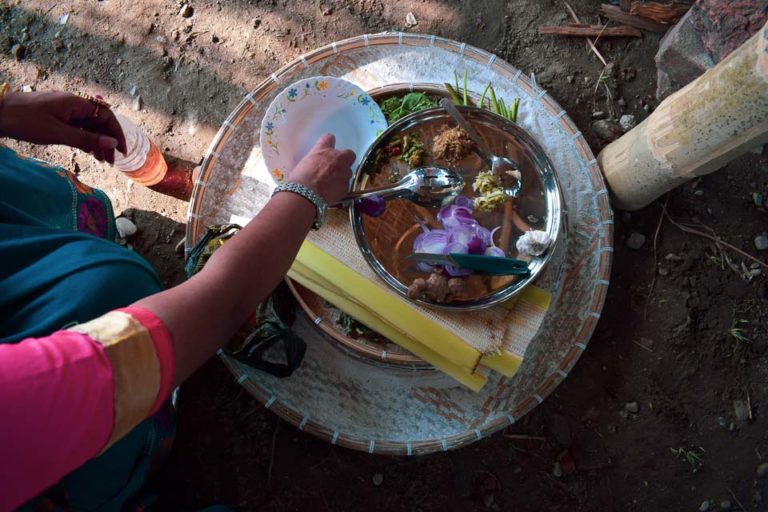
Find the location of a particular element. Image resolution: width=768 pixels, height=512 pixels. plate is located at coordinates (538, 201).